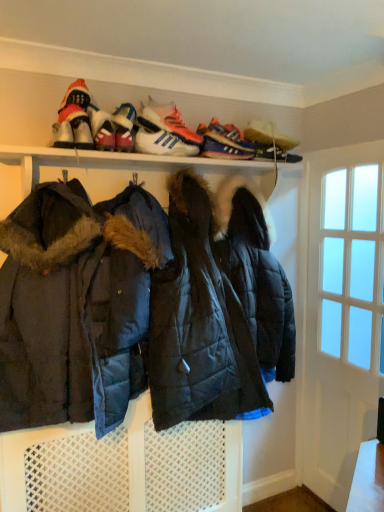
Question: Based on their positions, is white glass door at right located to the left or right of shiny pink sneaker at upper center, which is the 4th footwear from right to left?

Choices:
 (A) left
 (B) right

Answer: (B)

Question: Is white glass door at right spatially inside shiny pink sneaker at upper center, acting as the second footwear starting from the left, or outside of it?

Choices:
 (A) inside
 (B) outside

Answer: (B)

Question: Estimate the real-world distances between objects in this image. Which object is closer to the dark blue quilted jacket at center?

Choices:
 (A) shiny black shoe at upper right, which appears as the first footwear when viewed from the right
 (B) white glass door at right
 (C) white leather sneakers at upper center, the 3th footwear in the left-to-right sequence
 (D) white leather sneakers at upper center, which ranks as the fourth footwear in left-to-right order
 (E) purple suede sneaker at upper center, the 1th shoe positioned from the back

Answer: (D)

Question: Estimate the real-world distances between objects in this image. Which object is farther from the shiny pink sneaker at upper center, acting as the second footwear starting from the left?

Choices:
 (A) white glass door at right
 (B) purple suede sneaker at upper center, the 1th shoe positioned from the back
 (C) white leather sneaker at upper left, acting as the second shoe starting from the back
 (D) white leather sneakers at upper center, the third footwear positioned from the right
 (E) velvet-like red boot at upper left, the 1th footwear when ordered from left to right

Answer: (A)